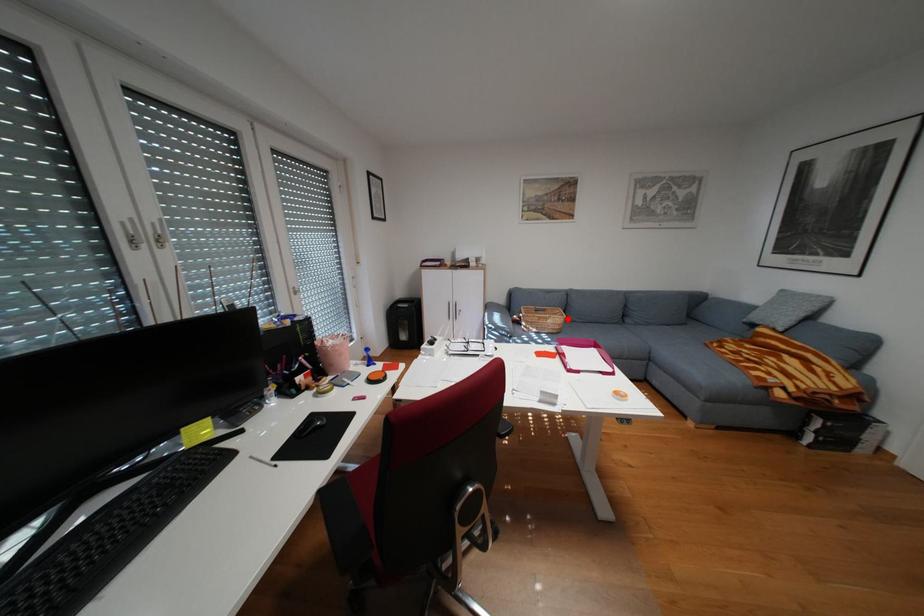
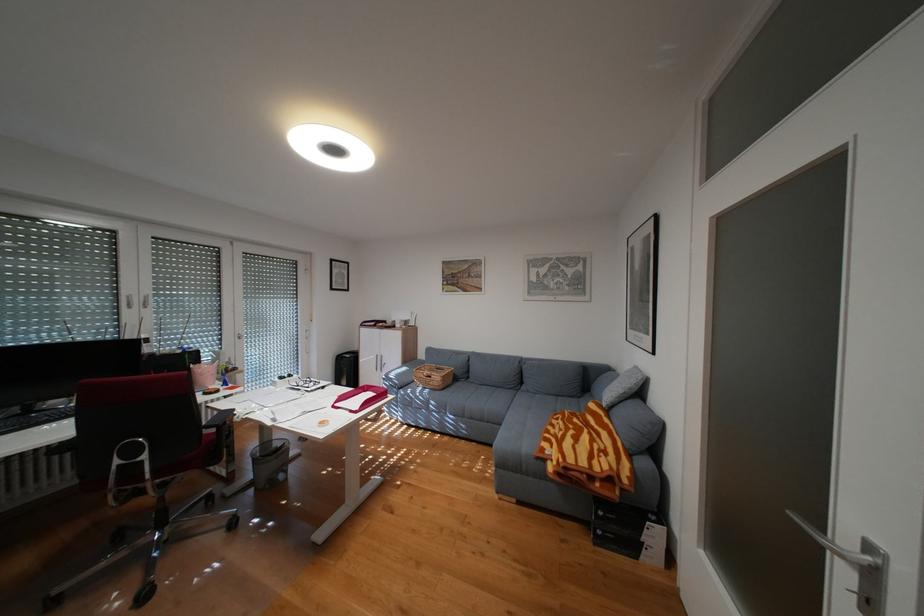
The point at the highlighted location is marked in the first image. Where is the corresponding point in the second image?

(450, 377)